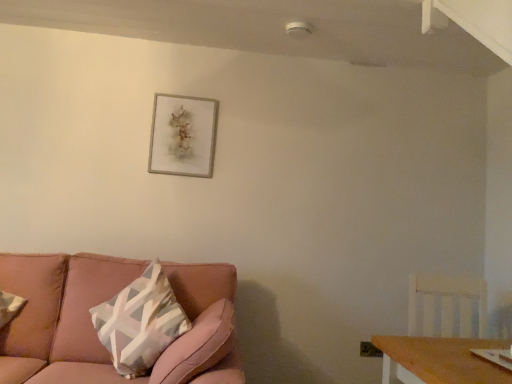
Image resolution: width=512 pixels, height=384 pixels. Describe the element at coordinates (183, 135) in the screenshot. I see `silver metallic picture frame at upper center` at that location.

The height and width of the screenshot is (384, 512). Describe the element at coordinates (95, 331) in the screenshot. I see `pink fabric couch at lower left` at that location.

Where is `silver metallic picture frame at upper center`? The image size is (512, 384). silver metallic picture frame at upper center is located at coordinates (183, 135).

Which is correct: white wood swivel chair at right is inside silver metallic picture frame at upper center, or outside of it?

The correct answer is: outside.

Does white wood swivel chair at right have a greater height compared to silver metallic picture frame at upper center?

No.

Does white wood swivel chair at right turn towards silver metallic picture frame at upper center?

No.

Can you tell me how much white wood swivel chair at right and silver metallic picture frame at upper center differ in facing direction?

11.9 degrees.

In terms of width, does silver metallic picture frame at upper center look wider or thinner when compared to white wood swivel chair at right?

Considering their sizes, silver metallic picture frame at upper center looks slimmer than white wood swivel chair at right.

Is point (164, 125) closer or farther from the camera than point (385, 356)?

Point (164, 125).

Considering the positions of objects silver metallic picture frame at upper center and white wood swivel chair at right in the image provided, who is more to the left, silver metallic picture frame at upper center or white wood swivel chair at right?

silver metallic picture frame at upper center.

From the image's perspective, is silver metallic picture frame at upper center above white wood swivel chair at right?

Yes, from the image's perspective, silver metallic picture frame at upper center is on top of white wood swivel chair at right.

Could you tell me if pink fabric couch at lower left is turned towards silver metallic picture frame at upper center?

No, pink fabric couch at lower left is not oriented towards silver metallic picture frame at upper center.

Does pink fabric couch at lower left lie behind silver metallic picture frame at upper center?

No, it is in front of silver metallic picture frame at upper center.

The height and width of the screenshot is (384, 512). What are the coordinates of `picture frame on the right of the pink fabric couch at lower left` in the screenshot? It's located at (183, 135).

Based on the photo, from a real-world perspective, is pink fabric couch at lower left positioned over white wood swivel chair at right based on gravity?

No, from a real-world perspective, pink fabric couch at lower left is not on top of white wood swivel chair at right.

From the image's perspective, is pink fabric couch at lower left on white wood swivel chair at right?

No, from the image's perspective, pink fabric couch at lower left is not above white wood swivel chair at right.

Is pink fabric couch at lower left to the right of white wood swivel chair at right from the viewer's perspective?

No, pink fabric couch at lower left is not to the right of white wood swivel chair at right.

I want to click on studio couch in front of the white wood swivel chair at right, so click(95, 331).

Is silver metallic picture frame at upper center spatially inside pink fabric couch at lower left, or outside of it?

silver metallic picture frame at upper center is not enclosed by pink fabric couch at lower left.

From a real-world perspective, which object rests below the other?

pink fabric couch at lower left.

From the image's perspective, is silver metallic picture frame at upper center under pink fabric couch at lower left?

No, from the image's perspective, silver metallic picture frame at upper center is not beneath pink fabric couch at lower left.

Considering the positions of point (414, 274) and point (37, 295), is point (414, 274) closer or farther from the camera than point (37, 295)?

Point (414, 274).

Identify the location of swivel chair that appears above the pink fabric couch at lower left (from a real-world perspective). Image resolution: width=512 pixels, height=384 pixels. (446, 306).

Is white wood swivel chair at right far from pink fabric couch at lower left?

white wood swivel chair at right is positioned a significant distance from pink fabric couch at lower left.

Is white wood swivel chair at right smaller than pink fabric couch at lower left?

Indeed, white wood swivel chair at right has a smaller size compared to pink fabric couch at lower left.

This screenshot has height=384, width=512. What are the coordinates of `swivel chair on the right of silver metallic picture frame at upper center` in the screenshot? It's located at tap(446, 306).

The image size is (512, 384). Find the location of `picture frame above the white wood swivel chair at right (from the image's perspective)`. picture frame above the white wood swivel chair at right (from the image's perspective) is located at coordinates (183, 135).

Estimate the real-world distances between objects in this image. Which object is further from pink fabric couch at lower left, silver metallic picture frame at upper center or white wood swivel chair at right?

white wood swivel chair at right is positioned further to the anchor pink fabric couch at lower left.

When comparing their distances from pink fabric couch at lower left, does white wood swivel chair at right or silver metallic picture frame at upper center seem further?

Based on the image, white wood swivel chair at right appears to be further to pink fabric couch at lower left.

Consider the image. When comparing their distances from white wood swivel chair at right, does pink fabric couch at lower left or silver metallic picture frame at upper center seem closer?

The object closer to white wood swivel chair at right is pink fabric couch at lower left.

When comparing their distances from white wood swivel chair at right, does silver metallic picture frame at upper center or pink fabric couch at lower left seem closer?

pink fabric couch at lower left is positioned closer to the anchor white wood swivel chair at right.

Estimate the real-world distances between objects in this image. Which object is further from silver metallic picture frame at upper center, white wood swivel chair at right or pink fabric couch at lower left?

white wood swivel chair at right.

From the image, which object appears to be farther from silver metallic picture frame at upper center, pink fabric couch at lower left or white wood swivel chair at right?

Among the two, white wood swivel chair at right is located further to silver metallic picture frame at upper center.

Identify the location of picture frame situated between pink fabric couch at lower left and white wood swivel chair at right from left to right. (183, 135).